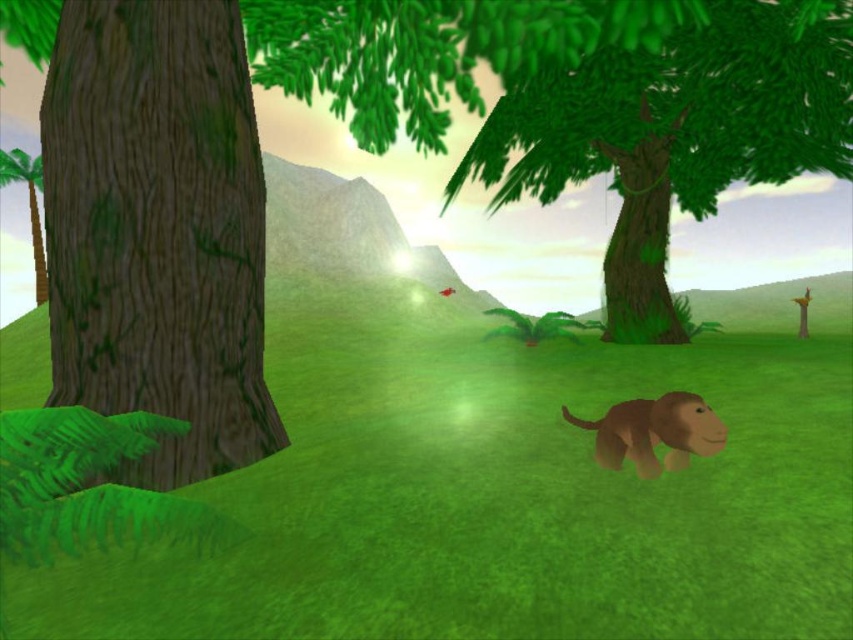
Question: Which point is closer to the camera taking this photo?

Choices:
 (A) (637, 406)
 (B) (848, 116)
 (C) (155, 355)
 (D) (26, 154)

Answer: (A)

Question: Which object appears closest to the camera in this image?

Choices:
 (A) brown matte monkey at center
 (B) green grass at center

Answer: (B)

Question: Does brown matte monkey at center appear on the right side of green matte palm tree at left?

Choices:
 (A) yes
 (B) no

Answer: (A)

Question: Where is green grass at center located in relation to brown textured tree at left in the image?

Choices:
 (A) below
 (B) above

Answer: (A)

Question: Which point is closer to the camera?

Choices:
 (A) green grass at center
 (B) brown textured tree at left
 (C) brown matte monkey at center

Answer: (A)

Question: Can you confirm if green matte tree at upper center is wider than brown matte monkey at center?

Choices:
 (A) yes
 (B) no

Answer: (A)